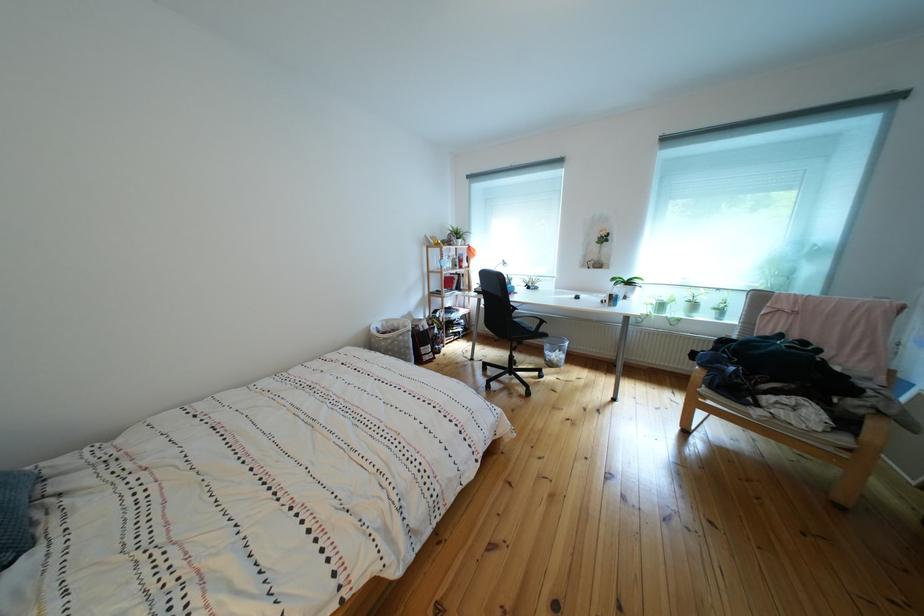
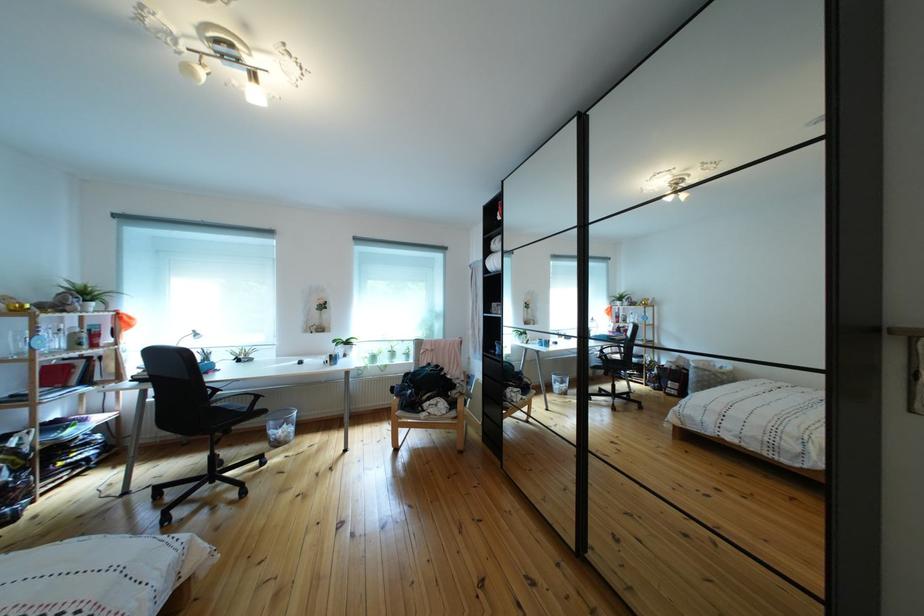
Question: The camera is either moving clockwise (left) or counter-clockwise (right) around the object. The first image is from the beginning of the video and the second image is from the end. Is the camera moving left or right when shooting the video?

Choices:
 (A) Left
 (B) Right

Answer: (A)